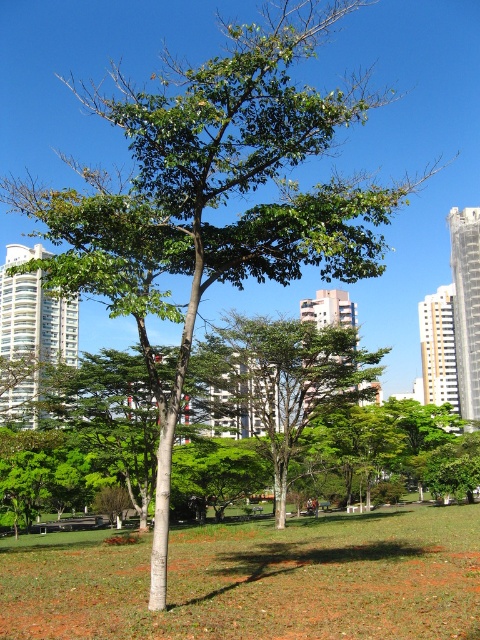
You are standing in the park and want to walk from the green grass at center to the green leafy tree at center. Which direction should you move to reach the tree?

The green grass at center is to the left of green leafy tree at center, so you should move to the right to reach the tree.

You are standing in the park and want to take a photo of both the point at coordinates (263,611) and the point at coordinates (237,349). Which point should you focus on first to ensure both are in clear view?

You should focus on point (263,611) first because it is closer to the camera than point (237,349), ensuring both are in focus when using a shallow depth of field.

You are a gardener who wants to mow the green grass at center and trim the green leafy tree at center. Which task should you do first if you want to tackle the shorter vegetation first?

The green grass at center is shorter than the green leafy tree at center, so you should mow the green grass at center first before trimming the taller green leafy tree at center.